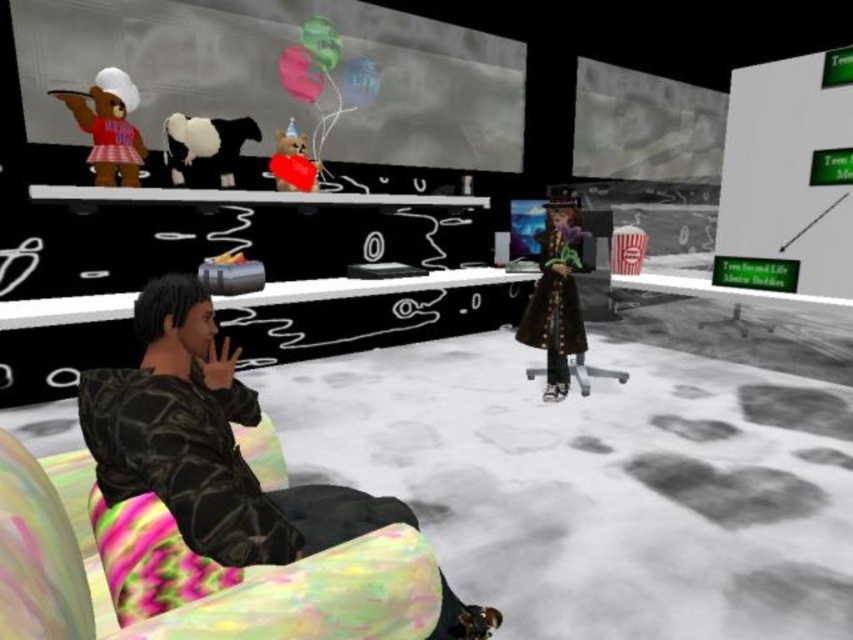
Which is below, camouflage jacket at left or velvet brown coat at center?

camouflage jacket at left is lower down.

Does camouflage jacket at left have a greater height compared to velvet brown coat at center?

In fact, camouflage jacket at left may be shorter than velvet brown coat at center.

Is point (103, 428) closer to viewer compared to point (579, 234)?

Yes.

Where is `camouflage jacket at left`? The image size is (853, 640). camouflage jacket at left is located at coordinates (206, 444).